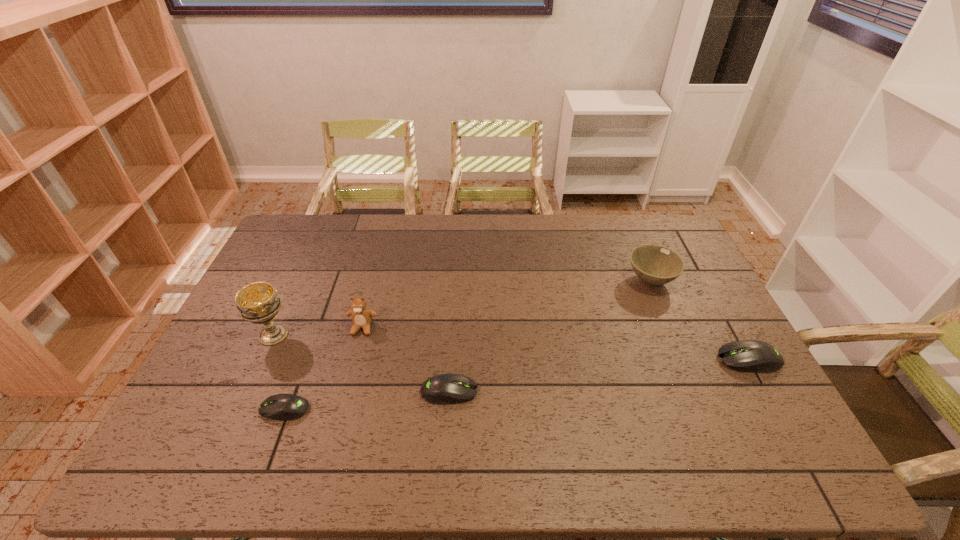
If we want them evenly spaced by inserting an extra mouse_(computer_equipment) among them, please locate a free spot for this new mouse_(computer_equipment). Please provide its 2D coordinates. Your answer should be formatted as a tuple, i.e. [(x, y)], where the tuple contains the x and y coordinates of a point satisfying the conditions above.

[(604, 375)]